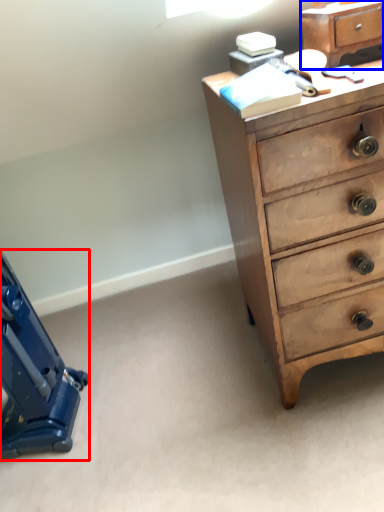
Question: Which point is further to the camera, equipment (highlighted by a red box) or file cabinet (highlighted by a blue box)?

Choices:
 (A) equipment
 (B) file cabinet

Answer: (A)